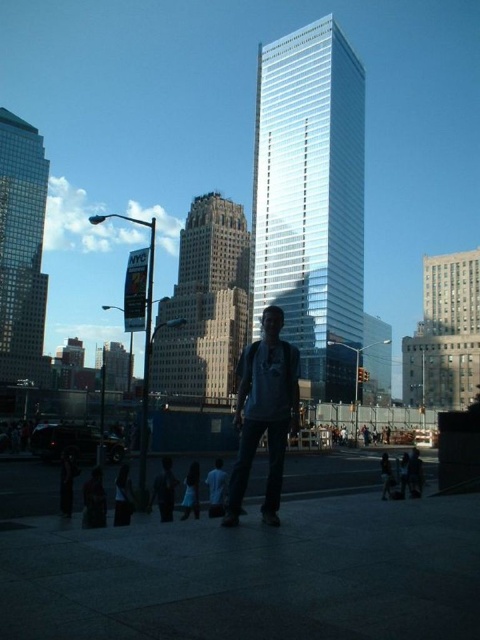
Can you confirm if glassy silver skyscraper at center is positioned to the right of shiny glass skyscraper at left?

Indeed, glassy silver skyscraper at center is positioned on the right side of shiny glass skyscraper at left.

Can you confirm if glassy silver skyscraper at center is positioned to the left of shiny glass skyscraper at left?

Incorrect, glassy silver skyscraper at center is not on the left side of shiny glass skyscraper at left.

Is point (268, 166) positioned in front of point (25, 262)?

That is True.

Where is `glassy silver skyscraper at center`? This screenshot has width=480, height=640. glassy silver skyscraper at center is located at coordinates (311, 200).

Does glassy silver skyscraper at center have a lesser height compared to gray cotton t-shirt at center?

No.

Is point (362, 275) farther from viewer compared to point (280, 317)?

Yes, point (362, 275) is farther from viewer.

This screenshot has height=640, width=480. What are the coordinates of `glassy silver skyscraper at center` in the screenshot? It's located at (311, 200).

Can you confirm if shiny glass skyscraper at left is smaller than gray cotton t-shirt at center?

Actually, shiny glass skyscraper at left might be larger than gray cotton t-shirt at center.

Does shiny glass skyscraper at left appear on the right side of gray cotton t-shirt at center?

Incorrect, shiny glass skyscraper at left is not on the right side of gray cotton t-shirt at center.

Between point (39, 304) and point (252, 372), which one is positioned in front?

Point (252, 372)

What are the coordinates of `shiny glass skyscraper at left` in the screenshot? It's located at (x=22, y=248).